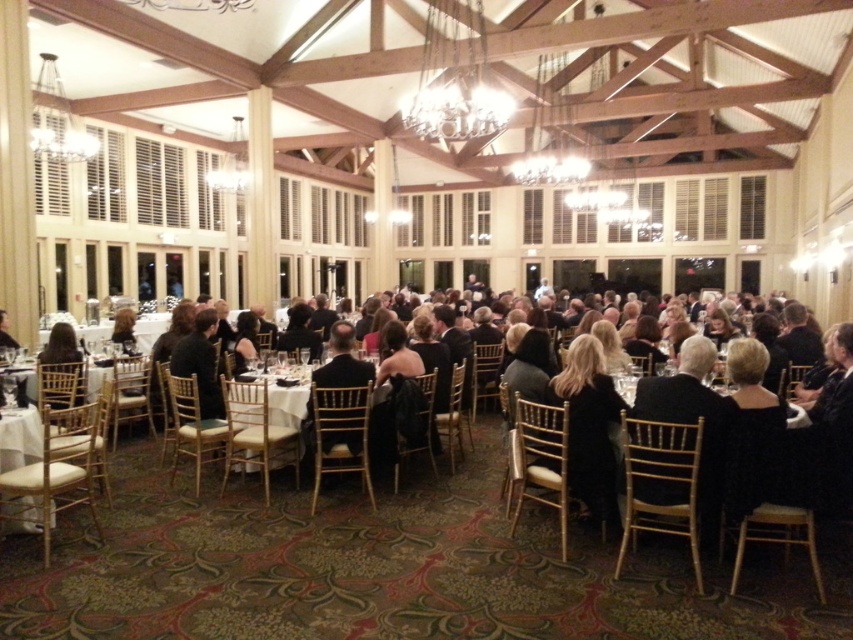
You are a photographer at the event and need to capture a closeup of the black satin suit at center and dark brown hair at center. Since the camera has a limited focus range, which object should you focus on first to ensure both are in frame?

The black satin suit at center is bigger than dark brown hair at center, so you should focus on the black satin suit at center first to ensure both are in frame.

You are a photographer standing in the banquet hall and want to capture a photo of the black satin suit at center and dark brown hair at center together in the frame. Given that your camera has a maximum focus range of 2 meters, will you be able to include both subjects in the same photo without moving closer?

The distance between the black satin suit at center and dark brown hair at center is 2.20 meters, which exceeds the camera maximum focus range of 2 meters. Therefore, you cannot include both subjects in the same photo without moving closer.

You are a photographer at the banquet hall and need to capture a closeup of both the black satin suit at center and the white cloth at center. Which object should you focus on first if you want to ensure both are in the frame without moving the camera?

The black satin suit at center is larger in size than the white cloth at center, so you should focus on the larger black satin suit at center first to ensure it fits within the frame, then adjust to include the smaller white cloth at center without moving the camera.